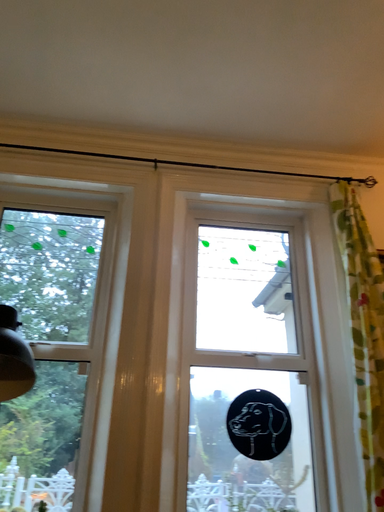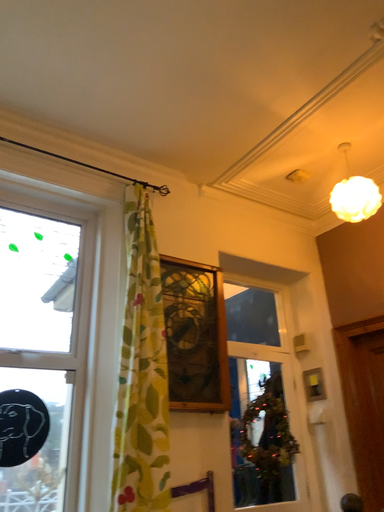
Question: How did the camera likely rotate when shooting the video?

Choices:
 (A) rotated left
 (B) rotated right

Answer: (B)